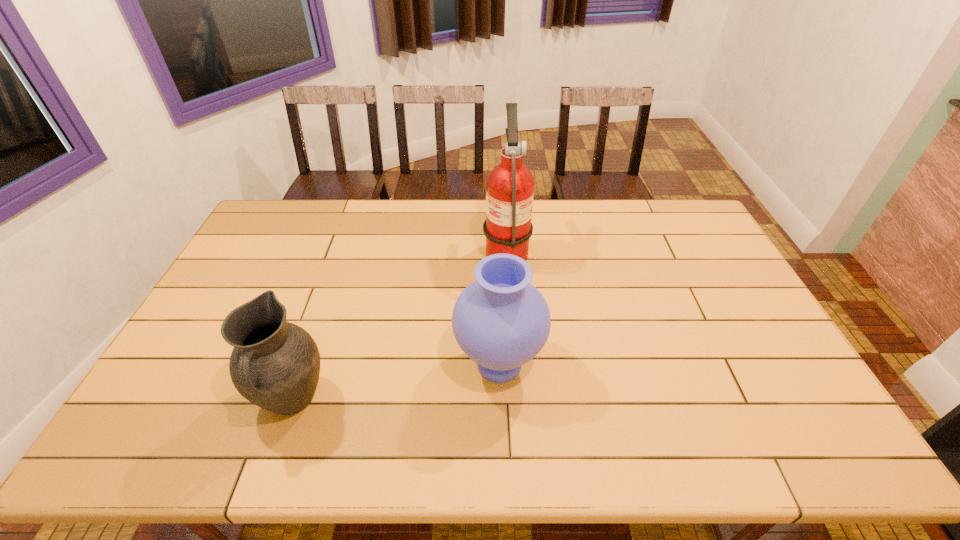
Where is `vacant position in the image that satisfies the following two spatial constraints: 1. on the nozzle and handle of the fire extinguisher; 2. on the side of the leftmost object with the handle`? vacant position in the image that satisfies the following two spatial constraints: 1. on the nozzle and handle of the fire extinguisher; 2. on the side of the leftmost object with the handle is located at coordinates (516, 400).

This screenshot has width=960, height=540. In order to click on free space that satisfies the following two spatial constraints: 1. on the nozzle and handle of the tallest object; 2. on the front side of the vase in this screenshot , I will do `click(514, 364)`.

This screenshot has width=960, height=540. In order to click on free region that satisfies the following two spatial constraints: 1. on the nozzle and handle of the farthest object; 2. on the front side of the vase in this screenshot , I will do `click(514, 364)`.